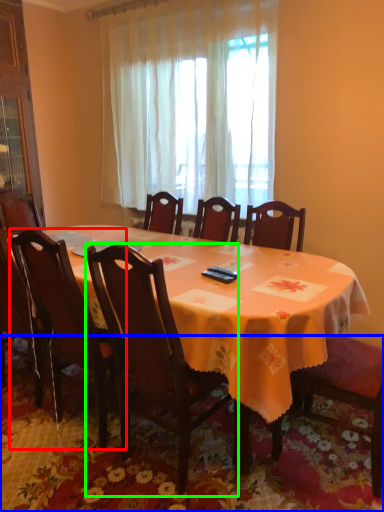
Question: Considering the real-world distances, which object is closest to chair (highlighted by a red box)? mat (highlighted by a blue box) or chair (highlighted by a green box).

Choices:
 (A) mat
 (B) chair

Answer: (B)